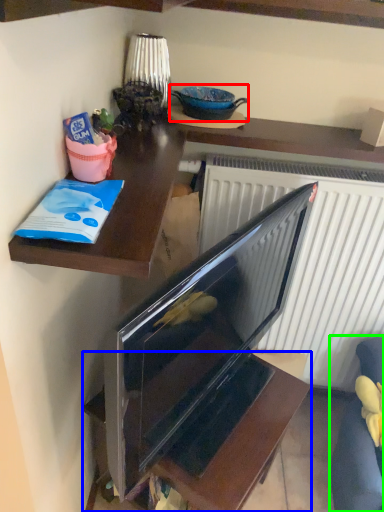
Question: Which object is positioned farthest from appliance (highlighted by a red box)? Select from furniture (highlighted by a blue box) and armchair (highlighted by a green box).

Choices:
 (A) furniture
 (B) armchair

Answer: (B)